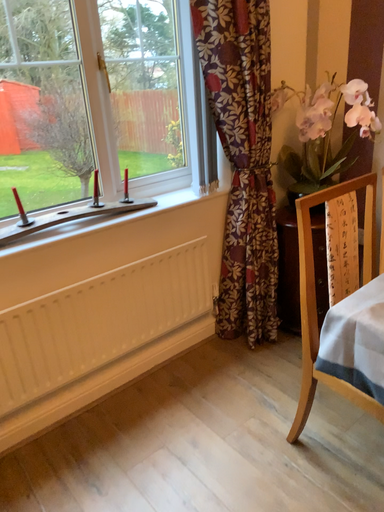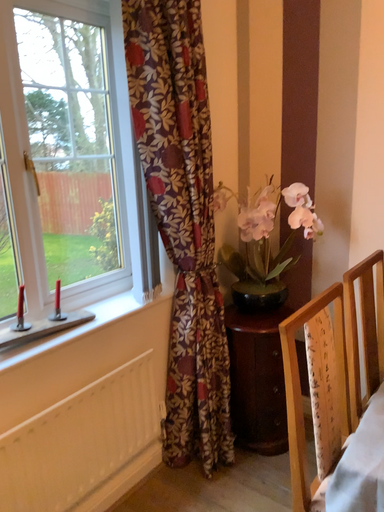
Question: How did the camera likely rotate when shooting the video?

Choices:
 (A) rotated downward
 (B) rotated upward

Answer: (B)